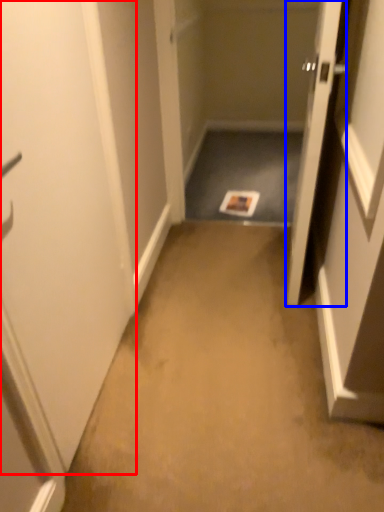
Question: Which object is further to the camera taking this photo, door (highlighted by a red box) or door (highlighted by a blue box)?

Choices:
 (A) door
 (B) door

Answer: (B)